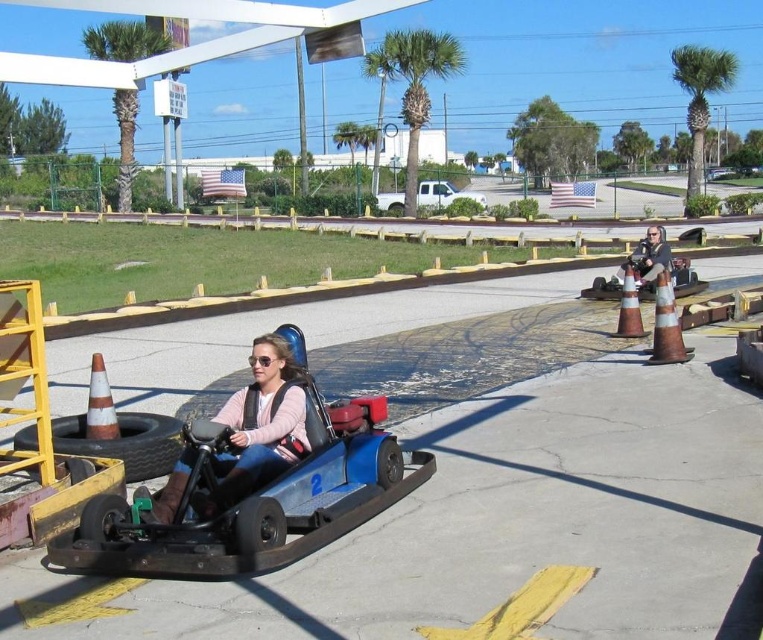
You are a photographer standing at the starting line of the go kart track. You want to take a photo of two points on the track, point (x=216, y=465) and point (x=665, y=301). Which point will appear larger in your photo?

Point (x=216, y=465) is closer to the camera than point (x=665, y=301), so it will appear larger in the photo.